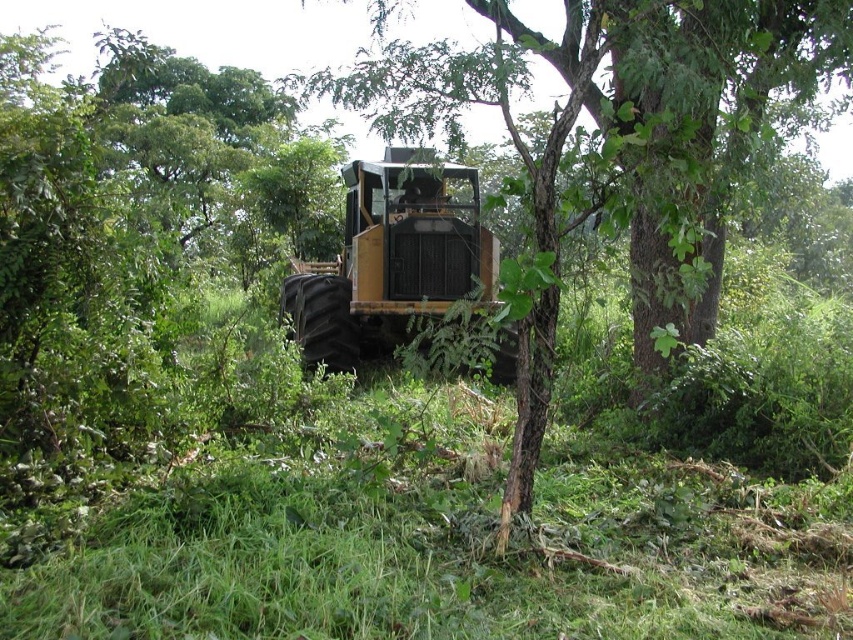
Based on the photo, does green leafy tree at center come behind yellow metallic tractor at center?

No, it is in front of yellow metallic tractor at center.

Is green leafy tree at center bigger than yellow metallic tractor at center?

Yes, green leafy tree at center is bigger than yellow metallic tractor at center.

In order to click on green leafy tree at center in this screenshot , I will do `click(619, 122)`.